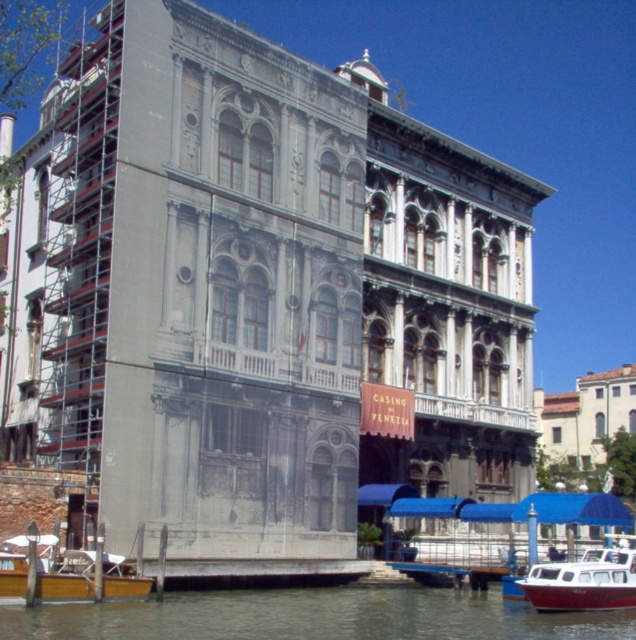
Question: Which object is closer to the camera taking this photo?

Choices:
 (A) greenish water at lower center
 (B) white plastic boat at lower right

Answer: (A)

Question: Is greenish water at lower center below white plastic boat at lower right?

Choices:
 (A) yes
 (B) no

Answer: (A)

Question: Where is greenish water at lower center located in relation to wooden polished boat at lower left in the image?

Choices:
 (A) right
 (B) left

Answer: (A)

Question: Which point is farther to the camera?

Choices:
 (A) (619, 570)
 (B) (13, 580)
 (C) (256, 609)

Answer: (A)

Question: Which object appears closest to the camera in this image?

Choices:
 (A) white plastic boat at lower right
 (B) wooden polished boat at lower left

Answer: (B)

Question: Is wooden polished boat at lower left to the left of white plastic boat at lower right from the viewer's perspective?

Choices:
 (A) yes
 (B) no

Answer: (A)